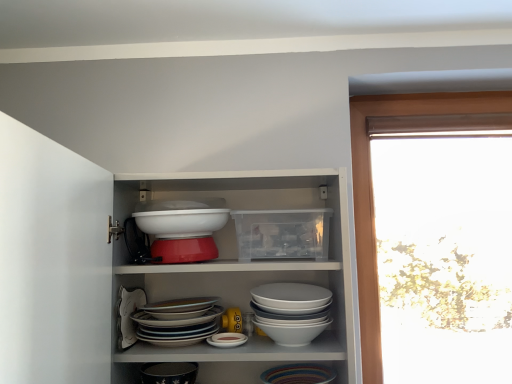
Question: In terms of size, does white glossy bowl at center, marked as the 1th bowl in a top-to-bottom arrangement, appear bigger or smaller than matte black bowl at lower center?

Choices:
 (A) small
 (B) big

Answer: (B)

Question: In terms of width, does white glossy bowl at center, which appears as the 3th bowl when ordered from the bottom, look wider or thinner when compared to matte black bowl at lower center?

Choices:
 (A) thin
 (B) wide

Answer: (B)

Question: Based on their relative distances, which object is farther from the white glossy bowls at center, the 2th bowl when ordered from top to bottom?

Choices:
 (A) matte black bowl at lower center
 (B) white glossy bowl at center, which appears as the 3th bowl when ordered from the bottom
 (C) white glossy bowl at center, which ranks as the 1th bowl in bottom-to-top order

Answer: (A)

Question: Which object is the farthest from the matte black bowl at lower center?

Choices:
 (A) white glossy bowls at center, acting as the 2th bowl starting from the bottom
 (B) white glossy bowl at center, which ranks as the 1th bowl in bottom-to-top order
 (C) white glossy bowl at center, which appears as the 3th bowl when ordered from the bottom

Answer: (C)